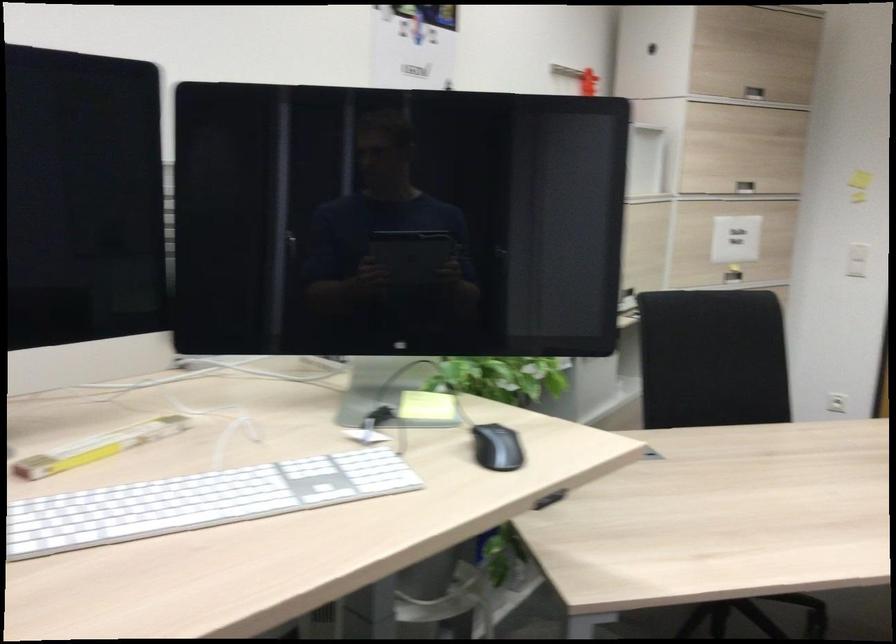
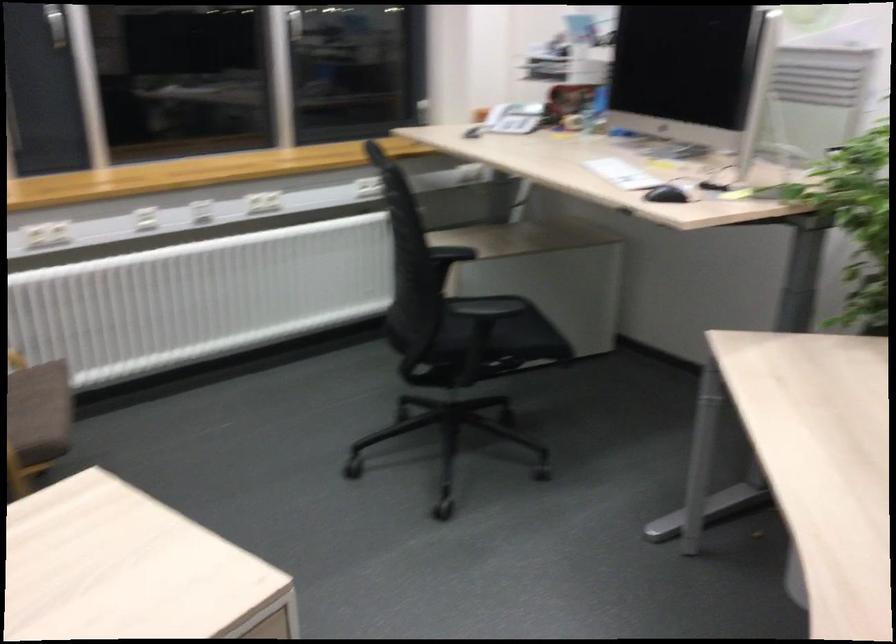
Find the pixel in the second image that matches point (243, 509) in the first image.

(622, 174)